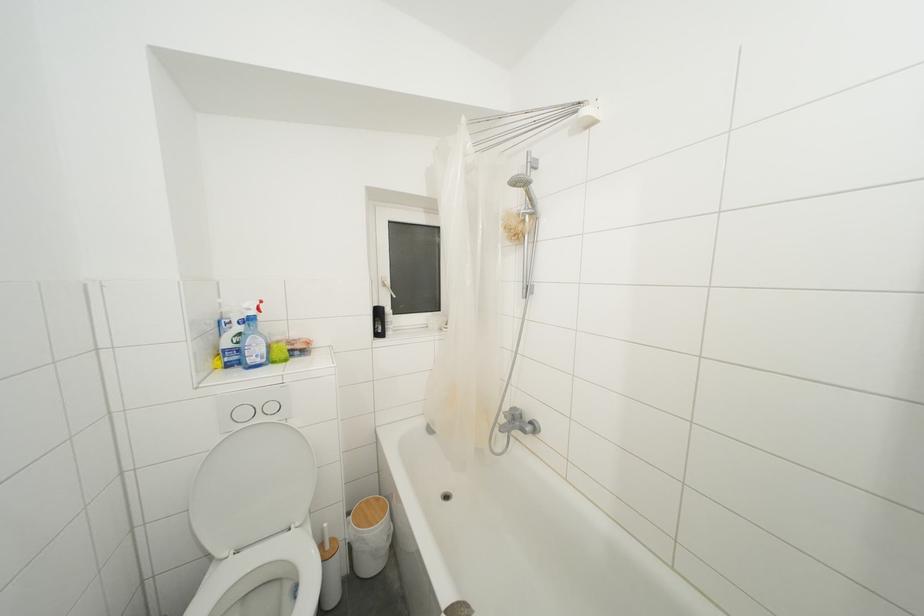
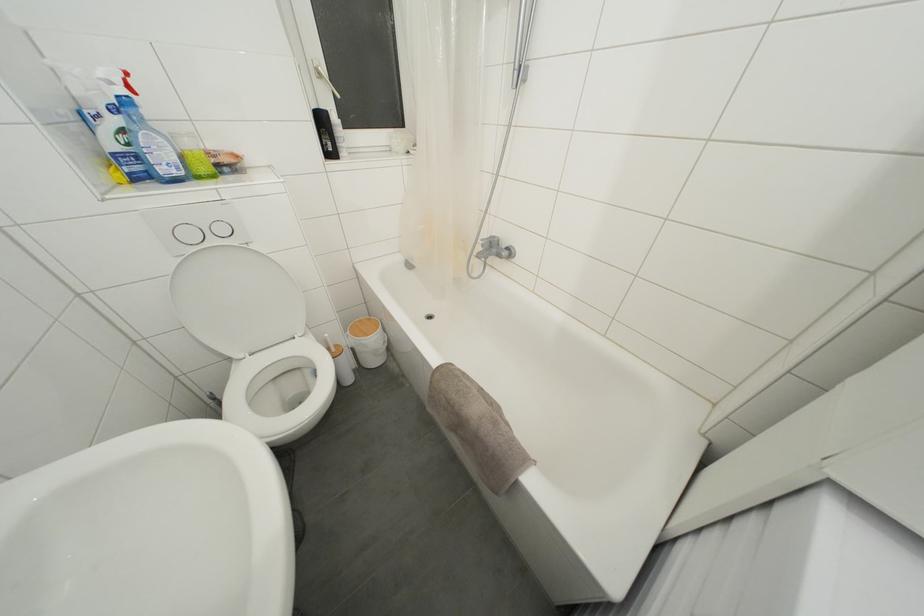
In the second image, find the point that corresponds to [388,290] in the first image.

(323, 79)